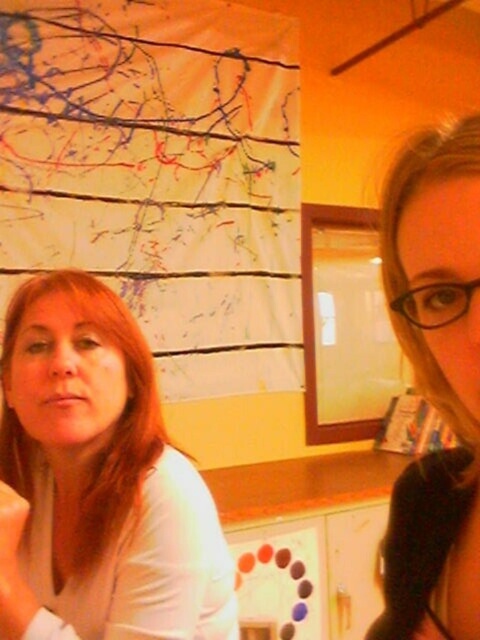
Looking at this image, you are a photographer adjusting your camera setup. You notice the smooth beige shirt at left and the smooth blonde hair at center in your frame. Which object should you focus on first if you want to prioritize the one closer to the camera?

The smooth beige shirt at left is positioned under the smooth blonde hair at center, meaning it is closer to the camera. Therefore, you should focus on the smooth beige shirt at left first.

You are a photographer trying to focus on the smooth beige shirt at left. What coordinates should you aim your camera at to capture it?

The smooth beige shirt at left is located at coordinates point (x=97, y=483). Aim your camera there.

You are a photographer trying to capture a portrait of the two people in the scene. You notice the smooth beige shirt at left and the smooth blonde hair at center. Which object should you focus on if you want to ensure that the taller one is in sharp focus?

The smooth beige shirt at left should be focused on because it has a greater height compared to the smooth blonde hair at center, making it the taller object in the scene.